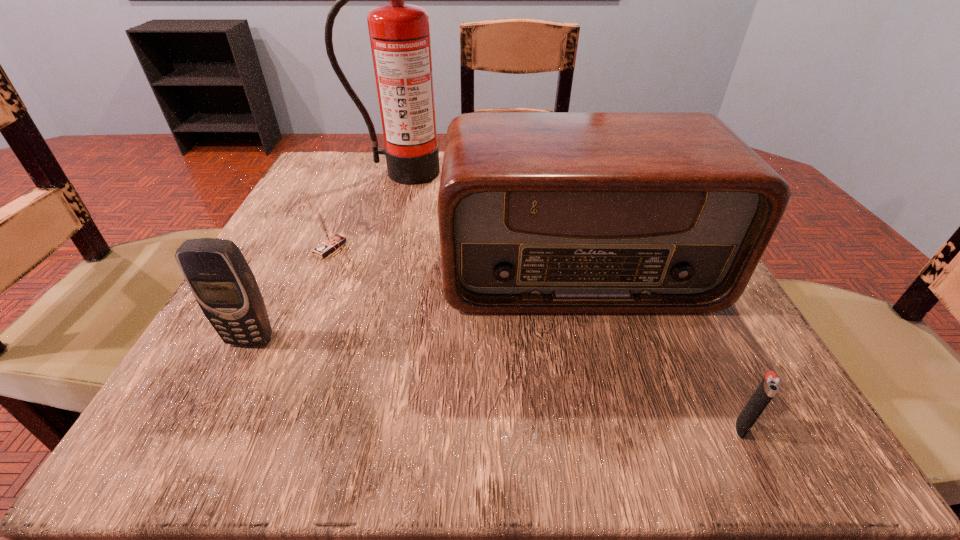
Image resolution: width=960 pixels, height=540 pixels. In order to click on the farthest object in this screenshot , I will do `click(399, 33)`.

The width and height of the screenshot is (960, 540). I want to click on the tallest object, so click(x=399, y=33).

Locate an element on the screen. radio receiver is located at coordinates (539, 212).

This screenshot has width=960, height=540. Identify the location of cellular telephone. (219, 277).

This screenshot has height=540, width=960. I want to click on the third shortest object, so click(x=219, y=277).

Where is `matchbox`? matchbox is located at coordinates (330, 242).

Image resolution: width=960 pixels, height=540 pixels. In order to click on the nearest object in this screenshot , I will do `click(770, 384)`.

This screenshot has width=960, height=540. In order to click on free point located on the front-facing side of the farthest object in this screenshot , I will do `click(373, 269)`.

This screenshot has height=540, width=960. Find the location of `vacant area situated on the front panel of the second tallest object`. vacant area situated on the front panel of the second tallest object is located at coordinates (610, 394).

I want to click on vacant space located 0.130m on the front face of the fourth farthest object, so click(199, 441).